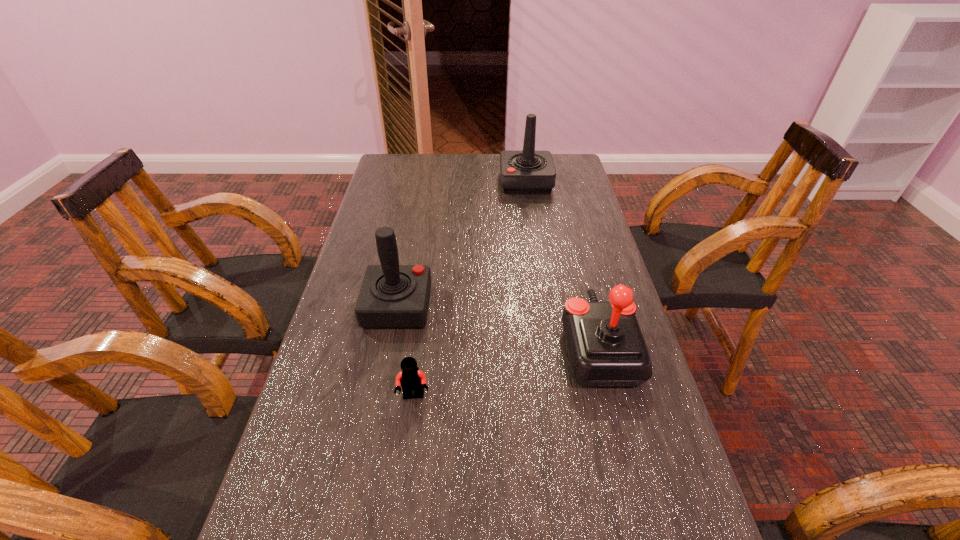
I want to click on the farthest joystick, so click(522, 172).

This screenshot has height=540, width=960. Find the location of `the leftmost joystick`. the leftmost joystick is located at coordinates (391, 296).

At what (x,y) coordinates should I click in order to perform the action: click on Lego. Please return your answer as a coordinate pair (x, y). The image size is (960, 540). Looking at the image, I should click on (411, 379).

At what (x,y) coordinates should I click in order to perform the action: click on free point located 0.300m on the front-facing side of the farthest object. Please return your answer as a coordinate pair (x, y). The width and height of the screenshot is (960, 540). Looking at the image, I should click on (417, 183).

Where is `free region located 0.360m on the front-facing side of the farthest object`? The height and width of the screenshot is (540, 960). free region located 0.360m on the front-facing side of the farthest object is located at coordinates (400, 183).

Image resolution: width=960 pixels, height=540 pixels. I want to click on vacant space located 0.390m on the front-facing side of the farthest object, so click(392, 183).

At what (x,y) coordinates should I click in order to perform the action: click on vacant area located 0.190m on the base of the leftmost joystick. Please return your answer as a coordinate pair (x, y). The image size is (960, 540). Looking at the image, I should click on (504, 307).

This screenshot has height=540, width=960. Find the location of `vacant space located on the front-facing side of the shortest object`. vacant space located on the front-facing side of the shortest object is located at coordinates (402, 490).

Identify the location of object situated at the far edge. This screenshot has height=540, width=960. (522, 172).

You are a GUI agent. You are given a task and a screenshot of the screen. Output one action in this format:
    pyautogui.click(x=<x>, y=<y>)
    Task: Click on the object present at the left edge
    This screenshot has width=960, height=540.
    Given the screenshot: What is the action you would take?
    pyautogui.click(x=391, y=296)